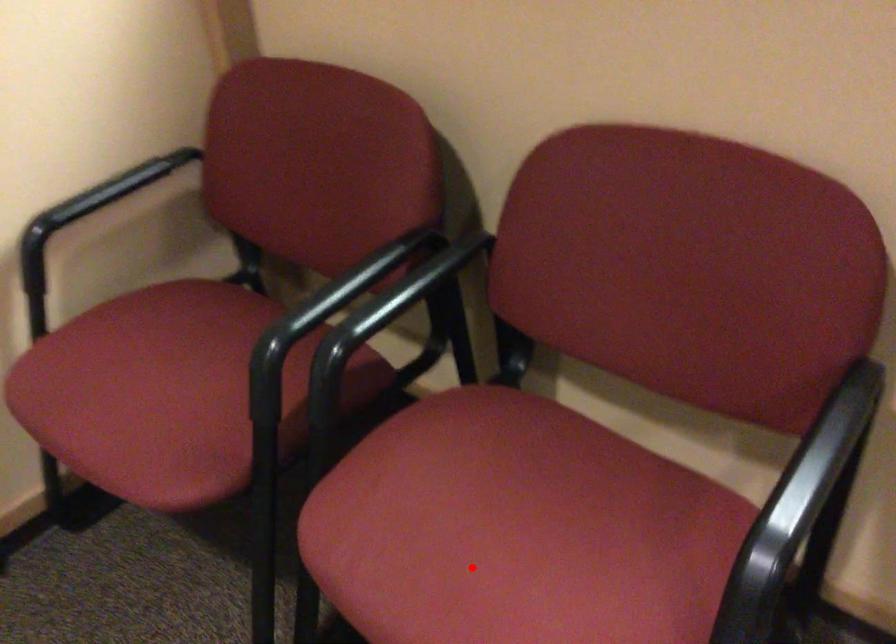
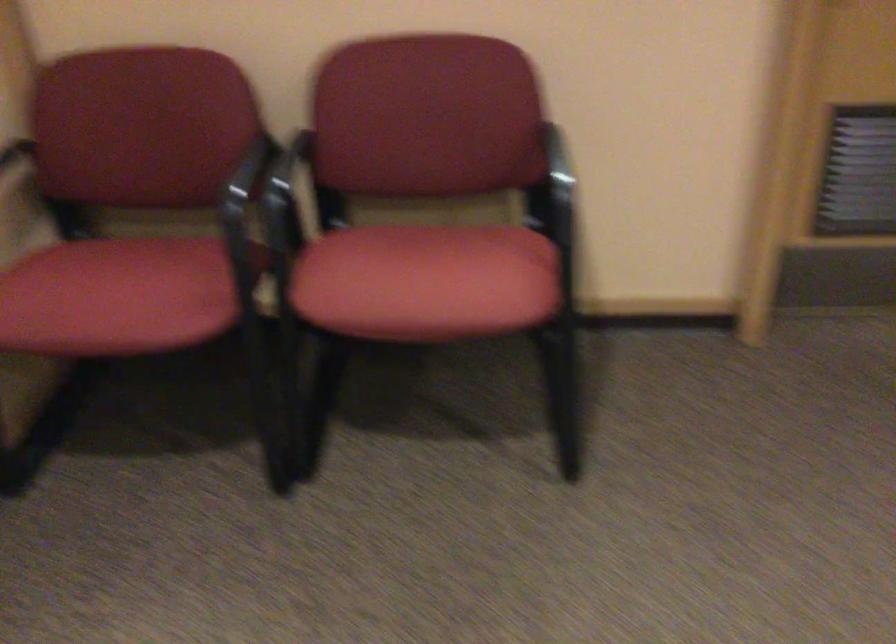
Question: A red point is marked in image1. In image2, is the corresponding 3D point closer to the camera or farther? Reply with the corresponding letter.

Choices:
 (A) The corresponding 3D point is closer.
 (B) The corresponding 3D point is farther.

Answer: (B)